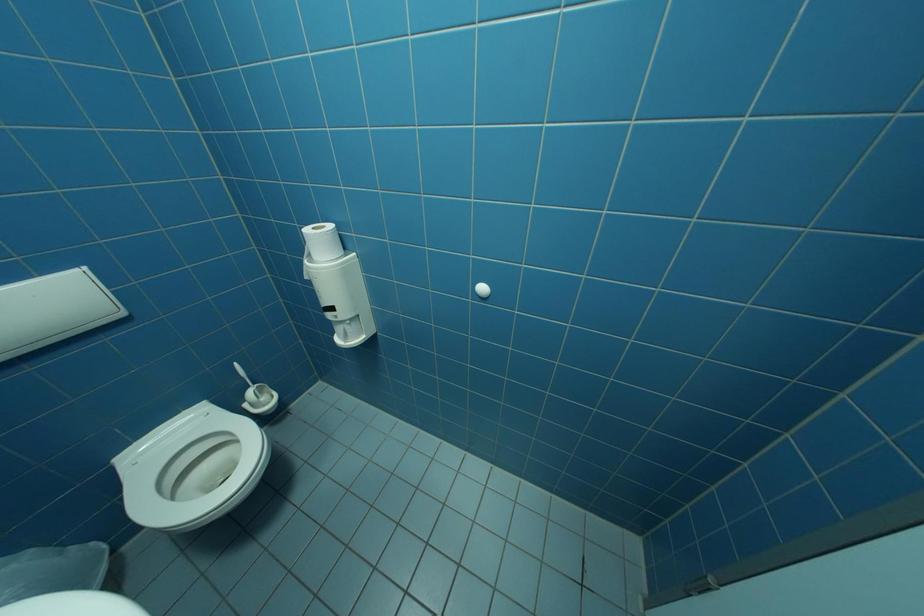
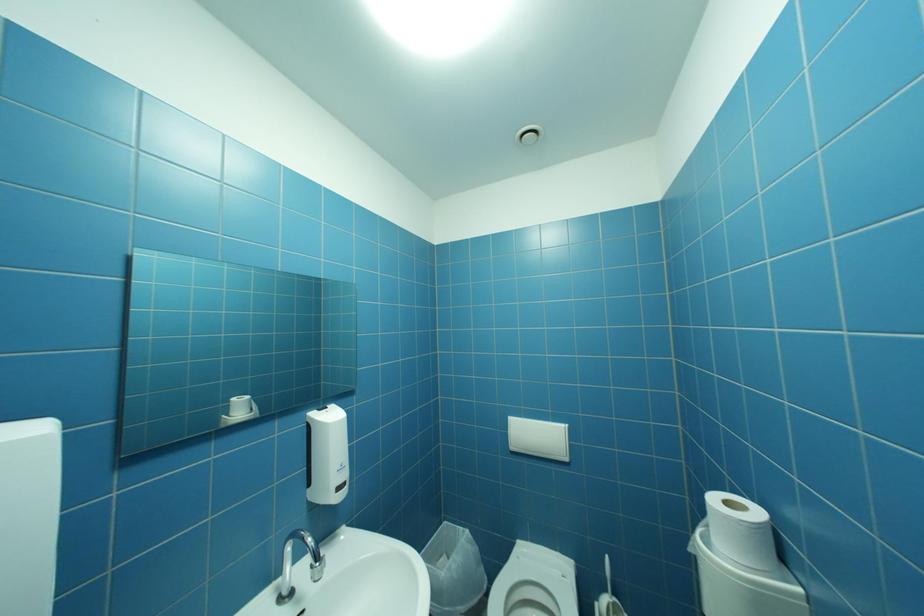
Question: The images are taken continuously from a first-person perspective. In which direction is your viewpoint rotating?

Choices:
 (A) Left
 (B) Right
 (C) Up
 (D) Down

Answer: (A)